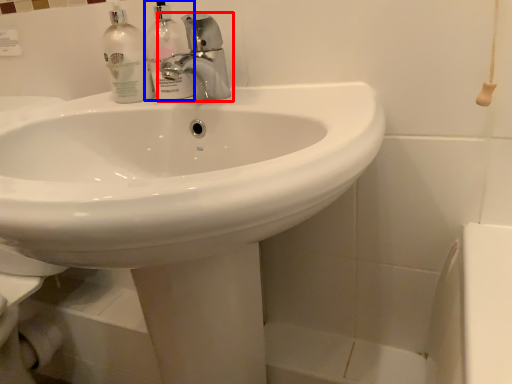
Question: Which point is closer to the camera, tap (highlighted by a red box) or cleaning product (highlighted by a blue box)?

Choices:
 (A) tap
 (B) cleaning product

Answer: (A)